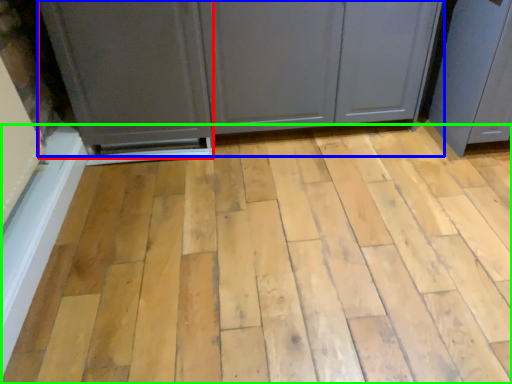
Question: Considering the real-world distances, which object is farthest from screen door (highlighted by a red box)? cupboard (highlighted by a blue box) or plank (highlighted by a green box)?

Choices:
 (A) cupboard
 (B) plank

Answer: (B)